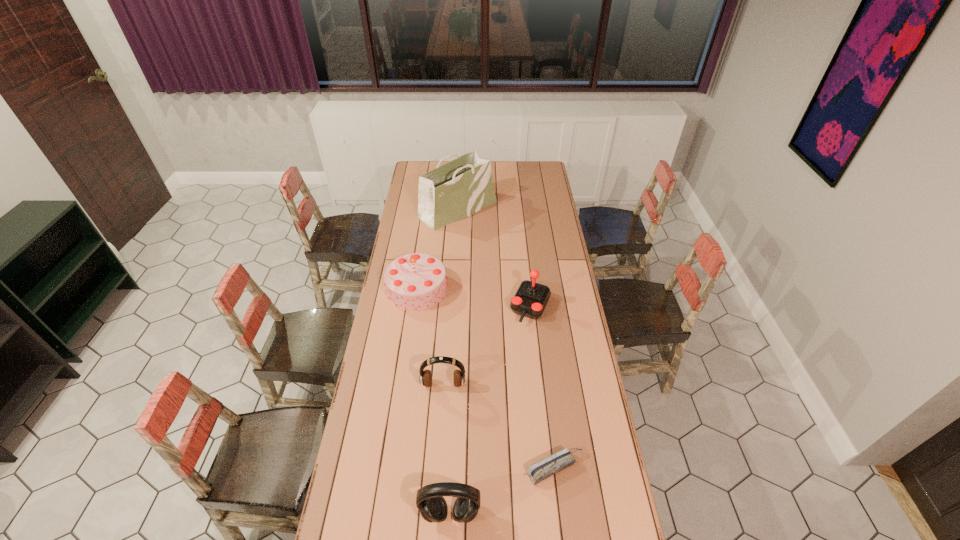
The width and height of the screenshot is (960, 540). In order to click on the tallest object in this screenshot , I will do `click(456, 190)`.

The width and height of the screenshot is (960, 540). What are the coordinates of `the farthest object` in the screenshot? It's located at (456, 190).

Identify the location of birthday cake. The image size is (960, 540). (417, 281).

This screenshot has width=960, height=540. Find the location of `joystick`. joystick is located at coordinates (530, 300).

You are a GUI agent. You are given a task and a screenshot of the screen. Output one action in this format:
    pyautogui.click(x=<x>, y=<y>)
    Task: Click on the nearest object
    
    Given the screenshot: What is the action you would take?
    pyautogui.click(x=433, y=507)

Image resolution: width=960 pixels, height=540 pixels. I want to click on the farther headset, so click(x=425, y=378).

Image resolution: width=960 pixels, height=540 pixels. What are the coordinates of `pencil box` in the screenshot? It's located at (539, 471).

Image resolution: width=960 pixels, height=540 pixels. Identify the location of the second nearest object. (539, 471).

The image size is (960, 540). In order to click on free space located 0.200m on the right of the farthest object in this screenshot , I will do `click(533, 209)`.

The image size is (960, 540). Identify the location of vacant space situated 0.080m on the right of the birthday cake. (466, 288).